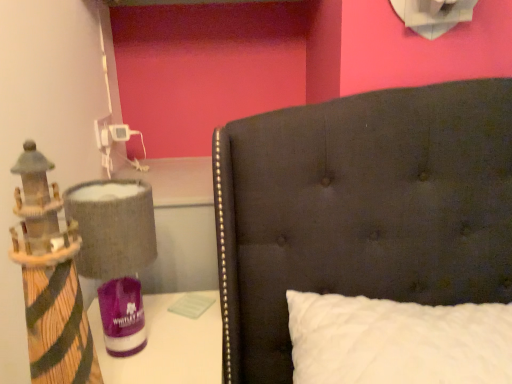
Question: Is wooden lighthouse at left facing away from textured fabric lampshade at left?

Choices:
 (A) yes
 (B) no

Answer: (A)

Question: Considering the relative sizes of wooden lighthouse at left and textured fabric lampshade at left in the image provided, is wooden lighthouse at left wider than textured fabric lampshade at left?

Choices:
 (A) yes
 (B) no

Answer: (B)

Question: From a real-world perspective, is wooden lighthouse at left on textured fabric lampshade at left?

Choices:
 (A) yes
 (B) no

Answer: (A)

Question: Can you confirm if wooden lighthouse at left is thinner than textured fabric lampshade at left?

Choices:
 (A) yes
 (B) no

Answer: (A)

Question: Considering the relative sizes of wooden lighthouse at left and textured fabric lampshade at left in the image provided, is wooden lighthouse at left shorter than textured fabric lampshade at left?

Choices:
 (A) yes
 (B) no

Answer: (B)

Question: Would you say textured fabric lampshade at left is inside or outside wooden lighthouse at left?

Choices:
 (A) outside
 (B) inside

Answer: (A)

Question: Is textured fabric lampshade at left wider or thinner than wooden lighthouse at left?

Choices:
 (A) thin
 (B) wide

Answer: (B)

Question: Considering the positions of point (79, 200) and point (33, 256), is point (79, 200) closer or farther from the camera than point (33, 256)?

Choices:
 (A) closer
 (B) farther

Answer: (B)

Question: From the image's perspective, is textured fabric lampshade at left above or below wooden lighthouse at left?

Choices:
 (A) above
 (B) below

Answer: (B)

Question: Is white quilted pillow at center wider or thinner than wooden lighthouse at left?

Choices:
 (A) thin
 (B) wide

Answer: (B)

Question: Which is correct: white quilted pillow at center is inside wooden lighthouse at left, or outside of it?

Choices:
 (A) inside
 (B) outside

Answer: (B)

Question: Looking at the image, does white quilted pillow at center seem bigger or smaller compared to wooden lighthouse at left?

Choices:
 (A) big
 (B) small

Answer: (A)

Question: Is white quilted pillow at center in front of or behind wooden lighthouse at left in the image?

Choices:
 (A) front
 (B) behind

Answer: (B)

Question: From the image's perspective, is wooden lighthouse at left above or below white quilted pillow at center?

Choices:
 (A) above
 (B) below

Answer: (A)

Question: Does point (50, 304) appear closer or farther from the camera than point (332, 355)?

Choices:
 (A) closer
 (B) farther

Answer: (A)